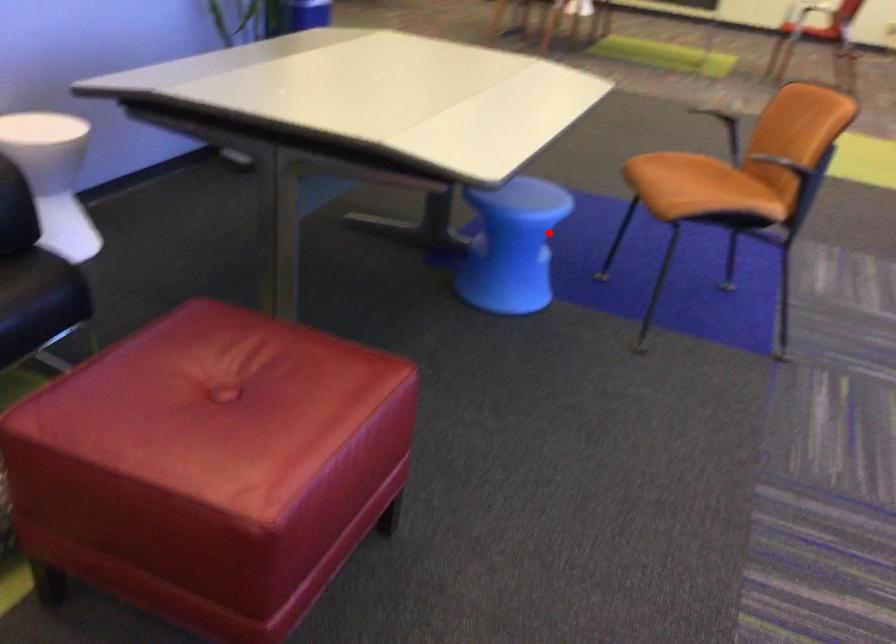
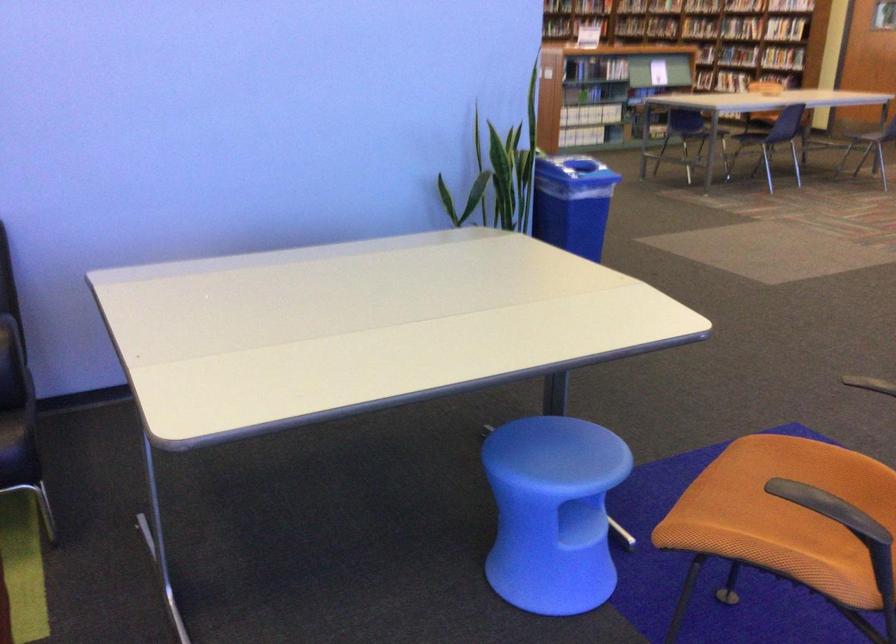
Question: I am providing you with two images of the same scene from different viewpoints. A red point is shown in image1. For the corresponding object point in image2, is it positioned nearer or farther from the camera?

Choices:
 (A) Nearer
 (B) Farther

Answer: (A)